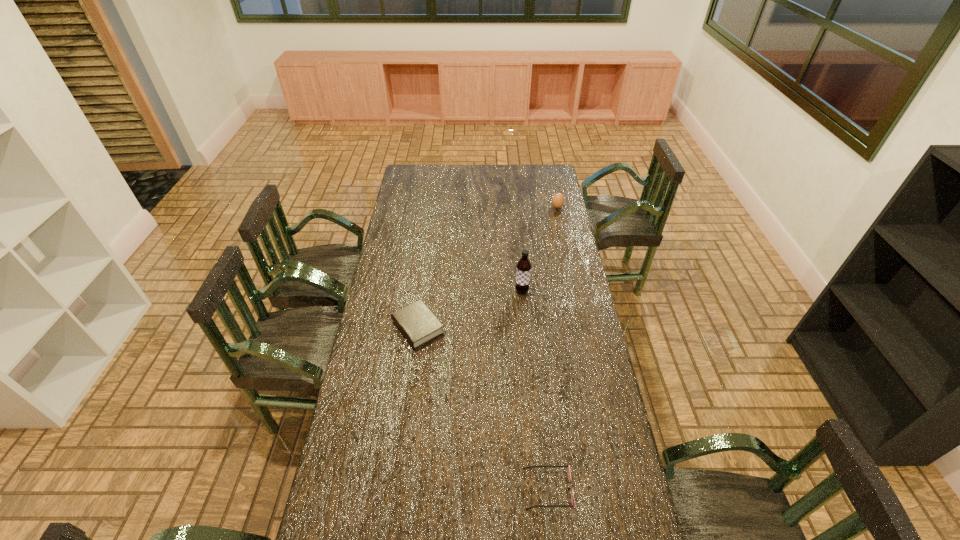
Find the location of `root beer`. root beer is located at coordinates (523, 271).

Find the location of `the second farthest object`. the second farthest object is located at coordinates (523, 271).

Find the location of a particular element. boiled egg is located at coordinates (558, 200).

Identify the location of the farthest object. (558, 200).

Where is `Bible`? This screenshot has height=540, width=960. Bible is located at coordinates (417, 323).

You are a GUI agent. You are given a task and a screenshot of the screen. Output one action in this format:
    pyautogui.click(x=<x>, y=<y>)
    Task: Click on the third farthest object
    
    Given the screenshot: What is the action you would take?
    pyautogui.click(x=417, y=323)

This screenshot has height=540, width=960. In order to click on the nearest object in this screenshot , I will do `click(568, 467)`.

Identify the location of sunglasses. The image size is (960, 540). (568, 467).

Identify the location of blank space located on the left of the root beer. The height and width of the screenshot is (540, 960). (473, 291).

You are a GUI agent. You are given a task and a screenshot of the screen. Output one action in this format:
    pyautogui.click(x=<x>, y=<y>)
    Task: Click on the vacant area situated on the front of the third shortest object
    Image resolution: width=960 pixels, height=540 pixels.
    Given the screenshot: What is the action you would take?
    pyautogui.click(x=561, y=224)